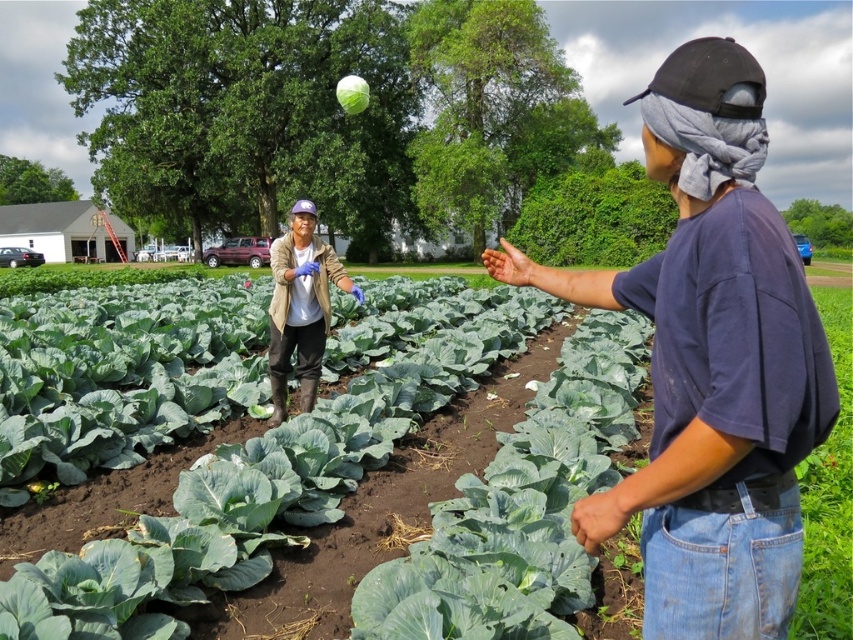
You are a farmer checking the growth of your crops. You notice two types of green leafy plants at center in your garden. Which one is taller between the green leafy vegetables at center and the green leafy cabbage at center?

The green leafy vegetables at center are taller than the green leafy cabbage at center according to the description.